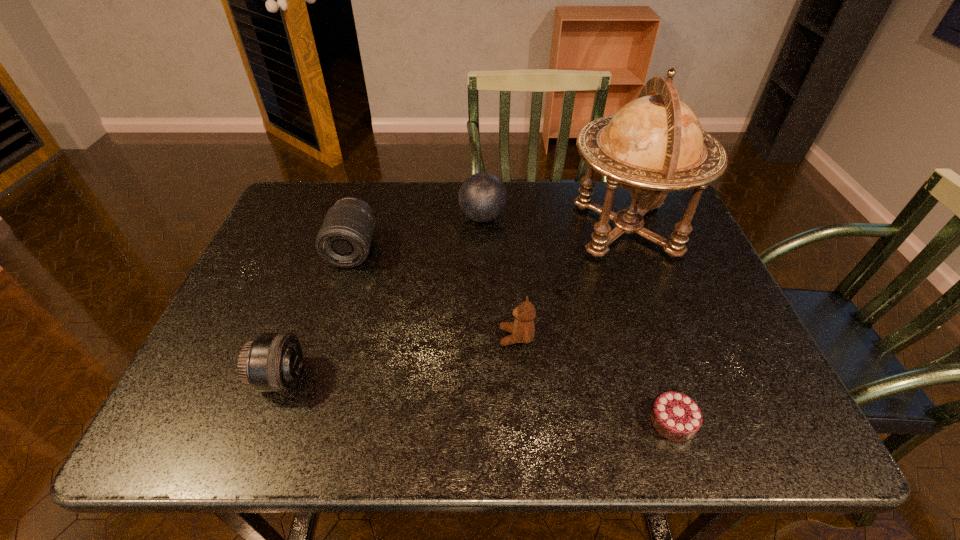
At what (x,y) coordinates should I click in order to perform the action: click on globe. Please return your answer as a coordinate pair (x, y). Looking at the image, I should click on (654, 144).

Locate an element on the screen. bowling ball is located at coordinates (482, 197).

The width and height of the screenshot is (960, 540). What are the coordinates of `the farther telephoto lens` in the screenshot? It's located at (344, 240).

Identify the location of the third nearest object. (523, 330).

Image resolution: width=960 pixels, height=540 pixels. I want to click on the nearer telephoto lens, so click(x=272, y=362).

I want to click on the shortest object, so click(675, 416).

At what (x,y) coordinates should I click in order to perform the action: click on vacant space situated 0.370m on the front-facing side of the globe. Please return your answer as a coordinate pair (x, y). This screenshot has width=960, height=540. Looking at the image, I should click on (434, 229).

What are the coordinates of `vacant region located on the front-facing side of the globe` in the screenshot? It's located at (422, 229).

At what (x,y) coordinates should I click in order to perform the action: click on vacant space located on the front-facing side of the globe. Please return your answer as a coordinate pair (x, y). The image size is (960, 540). Looking at the image, I should click on (546, 229).

This screenshot has width=960, height=540. Identify the location of vacant space located 0.360m on the grip area of the bowling ball. (336, 217).